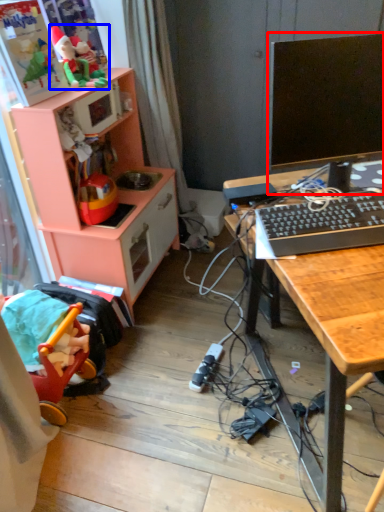
Question: Which object appears closest to the camera in this image, computer monitor (highlighted by a red box) or toy (highlighted by a blue box)?

Choices:
 (A) computer monitor
 (B) toy

Answer: (A)